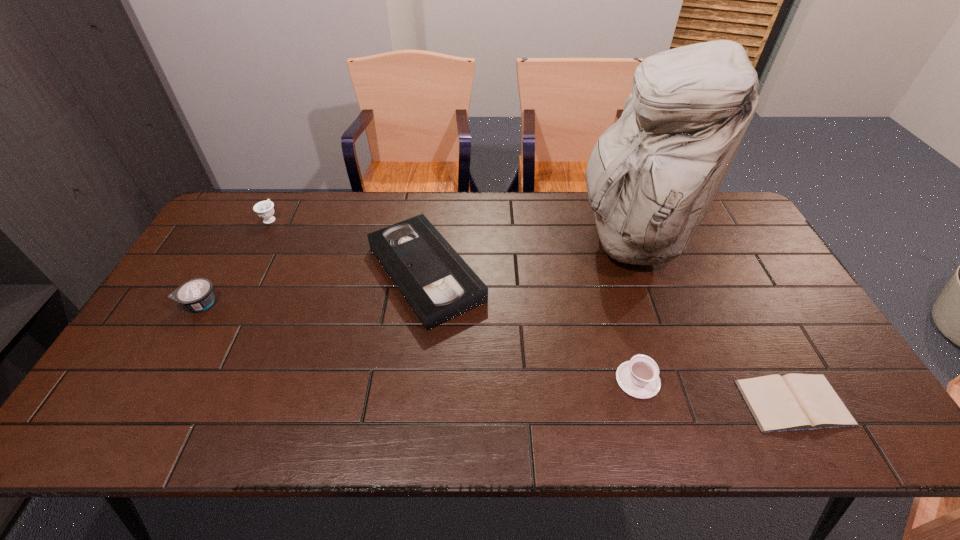
Identify the location of the tallest object. (652, 176).

I want to click on the left teacup, so click(x=264, y=209).

You are a GUI agent. You are given a task and a screenshot of the screen. Output one action in this format:
    pyautogui.click(x=<x>, y=<y>)
    Task: Click on the fourth object from right to left
    
    Given the screenshot: What is the action you would take?
    pyautogui.click(x=437, y=283)

This screenshot has width=960, height=540. In order to click on the right teacup in this screenshot , I will do `click(639, 377)`.

Identify the location of yogurt. (197, 294).

Where is `the shortest object`? the shortest object is located at coordinates (791, 402).

At what (x,y) coordinates should I click in order to perform the action: click on free space located 0.350m on the front-facing side of the tallest object. Please return your answer as a coordinate pair (x, y). Looking at the image, I should click on (467, 238).

Where is `vacant space situated 0.380m on the front-facing side of the tallest object`? The image size is (960, 540). vacant space situated 0.380m on the front-facing side of the tallest object is located at coordinates pyautogui.click(x=457, y=238).

Locate an element on the screen. This screenshot has height=540, width=960. vacant region located on the front-facing side of the tallest object is located at coordinates (485, 238).

You are a GUI agent. You are given a task and a screenshot of the screen. Output one action in this format:
    pyautogui.click(x=<x>, y=<y>)
    Task: Click on the vacant area situated on the back of the third object from left to right
    This screenshot has height=540, width=960.
    Given the screenshot: What is the action you would take?
    pyautogui.click(x=434, y=204)